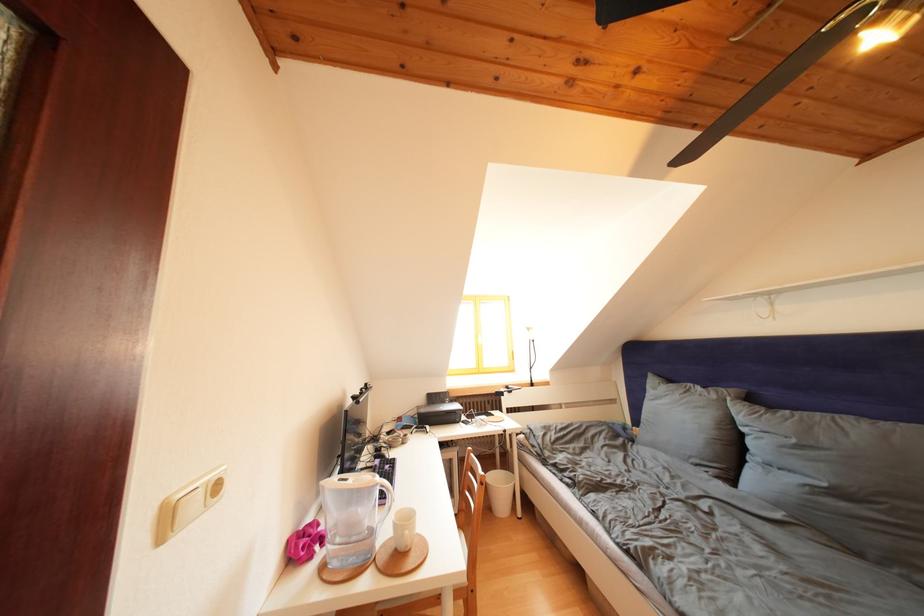
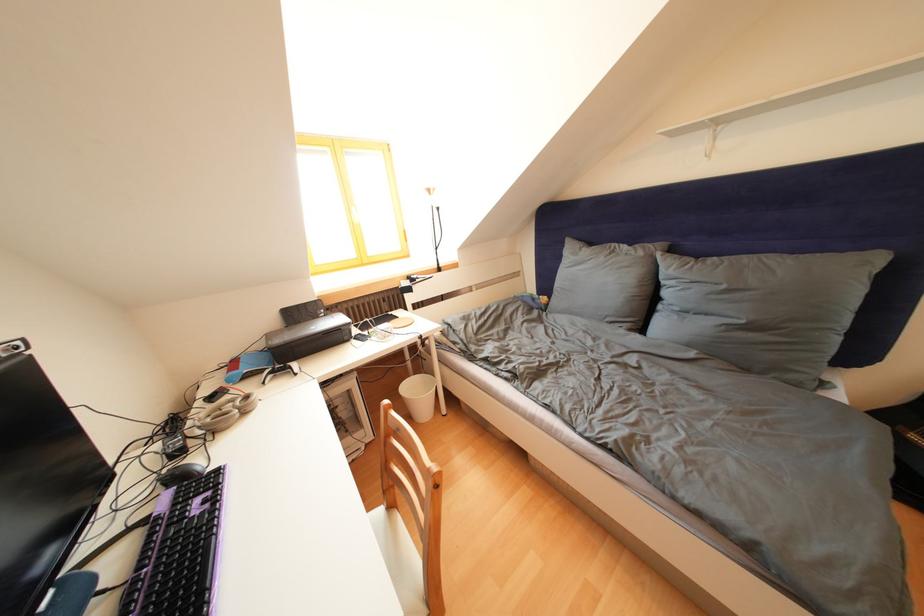
Where in the second image is the point corresponding to pixel 451 407 from the first image?

(323, 322)